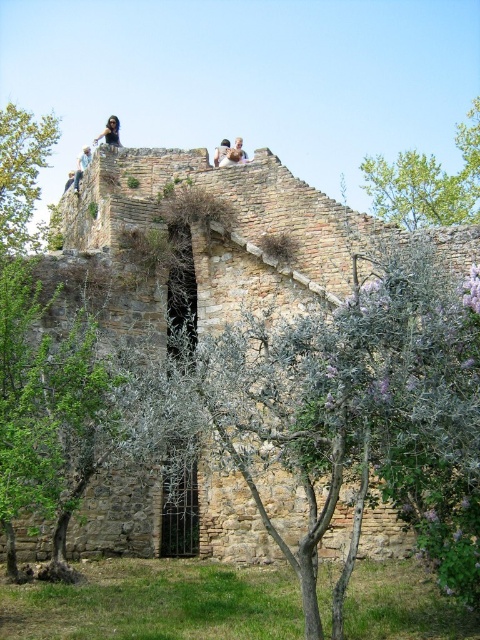
Between green leafy olive tree at center and dark brown leather jacket at upper center, which one is positioned lower?

green leafy olive tree at center is lower down.

Measure the distance between point (253, 449) and camera.

179.82 feet

Describe the element at coordinates (342, 416) in the screenshot. Image resolution: width=480 pixels, height=640 pixels. I see `green leafy olive tree at center` at that location.

What are the coordinates of `green leafy olive tree at center` in the screenshot? It's located at (342, 416).

Is point (237, 138) positioned in front of point (72, 180)?

No, (237, 138) is further to viewer.

At what (x,y) coordinates should I click in order to perform the action: click on light brown hair at upper center. Please return your answer as a coordinate pair (x, y). The height and width of the screenshot is (640, 480). Looking at the image, I should click on (239, 150).

Can you confirm if dark hair at upper center is wider than dark brown hair at upper center?

Yes.

Does point (105, 140) come in front of point (68, 186)?

Yes, point (105, 140) is in front of point (68, 186).

The width and height of the screenshot is (480, 640). What are the coordinates of `dark hair at upper center` in the screenshot? It's located at (109, 131).

Locate an element on the screen. This screenshot has height=640, width=480. dark hair at upper center is located at coordinates (109, 131).